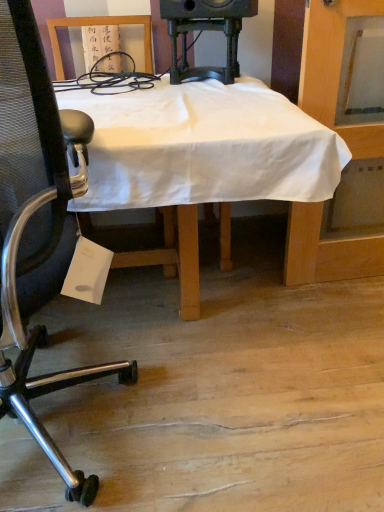
Where is `vacant location below metallic mesh chair at left (from a real-world perspective)`? The image size is (384, 512). vacant location below metallic mesh chair at left (from a real-world perspective) is located at coordinates (83, 441).